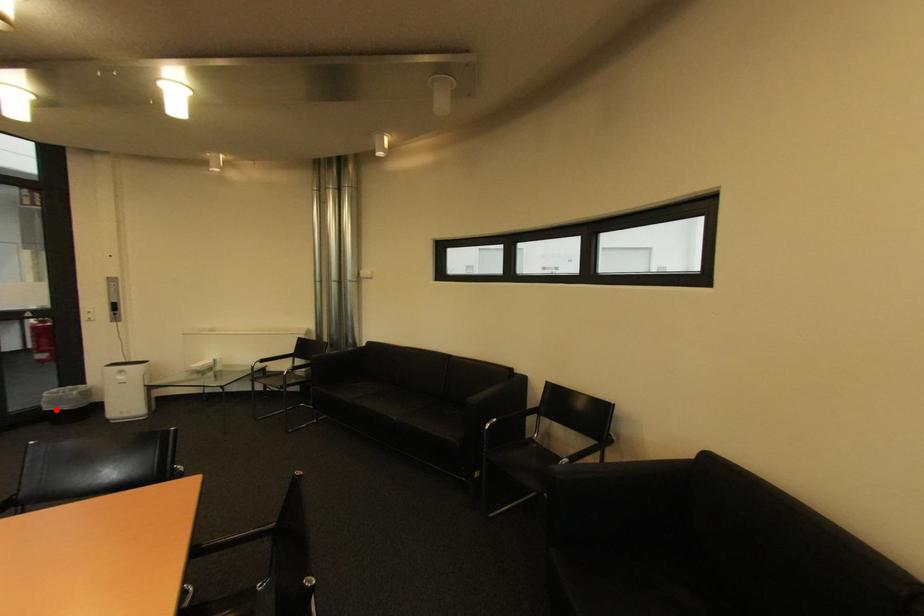
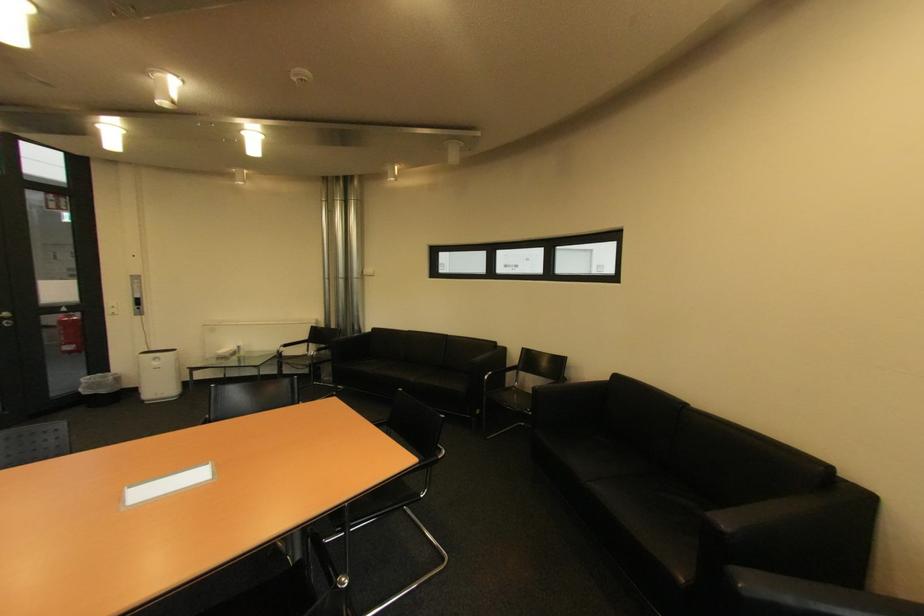
Locate, in the second image, the point that corresponds to the highlighted location in the first image.

(94, 394)